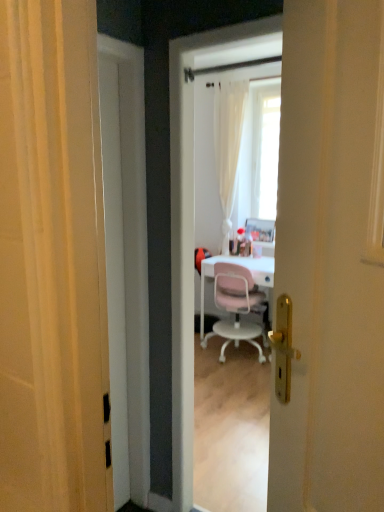
Question: Is white glossy door at center situated inside white glossy screen door at center or outside?

Choices:
 (A) inside
 (B) outside

Answer: (B)

Question: Is white glossy door at center taller or shorter than white glossy screen door at center?

Choices:
 (A) short
 (B) tall

Answer: (A)

Question: Considering the real-world distances, which object is farthest from the white glossy door at center?

Choices:
 (A) pink plastic chair at center
 (B) white glossy screen door at center

Answer: (B)

Question: Based on their relative distances, which object is farther from the white glossy screen door at center?

Choices:
 (A) white glossy door at center
 (B) pink plastic chair at center

Answer: (A)